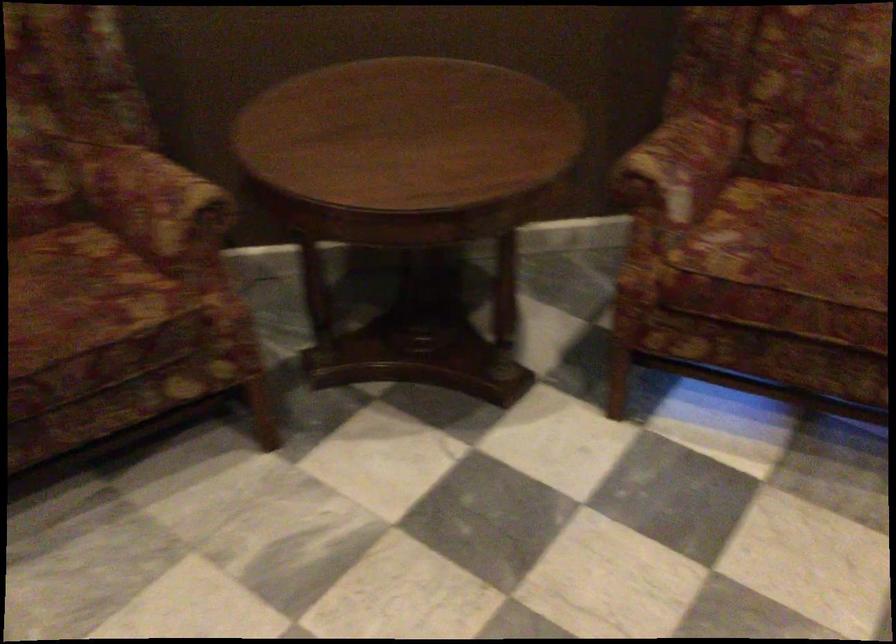
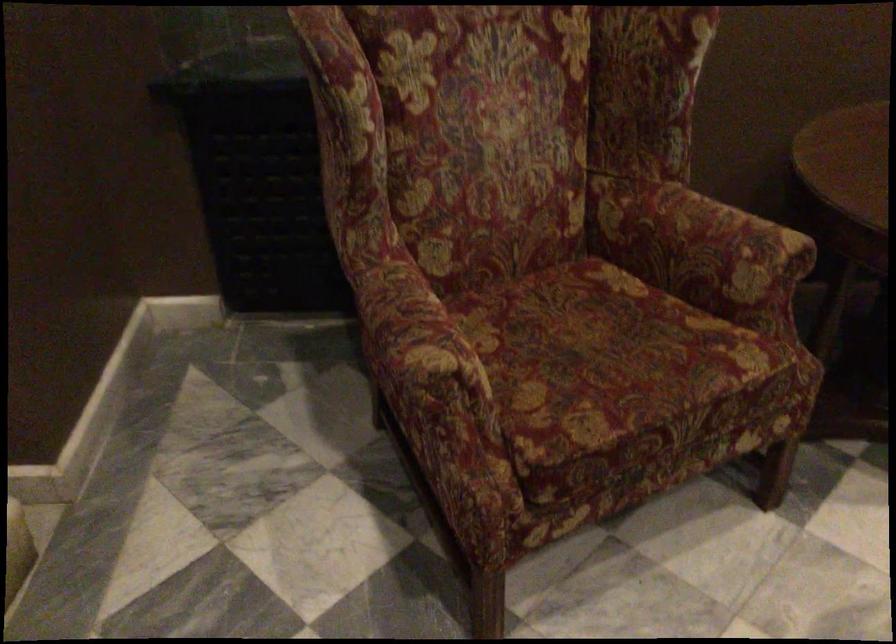
Locate, in the second image, the point that corresponds to the point at 143,203 in the first image.

(700, 243)